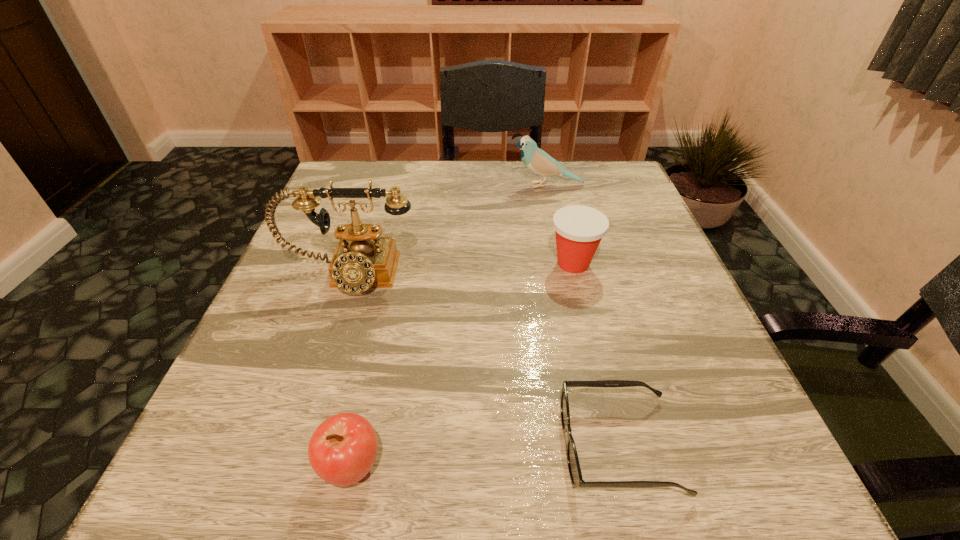
Where is `vacant area at the far right corner of the desktop`? vacant area at the far right corner of the desktop is located at coordinates click(621, 181).

Image resolution: width=960 pixels, height=540 pixels. Identify the location of vacant area that lies between the telephone and the Dixie cup. (461, 269).

The image size is (960, 540). In order to click on vacant area that lies between the sunglasses and the tallest object in this screenshot , I will do `click(484, 360)`.

Find the location of a particular element. The height and width of the screenshot is (540, 960). vacant space that's between the sunglasses and the tallest object is located at coordinates (484, 360).

Identify the location of vacant area between the bird and the tallest object. (447, 231).

The height and width of the screenshot is (540, 960). Identify the location of free space between the shortest object and the apple. (486, 456).

At what (x,y) coordinates should I click in order to perform the action: click on free spot between the second tallest object and the telephone. Please return your answer as a coordinate pair (x, y). The height and width of the screenshot is (540, 960). Looking at the image, I should click on (447, 231).

In order to click on vacant point located between the tallest object and the Dixie cup in this screenshot , I will do `click(461, 269)`.

Where is `vacant area that lies between the shortest object and the apple`? The width and height of the screenshot is (960, 540). vacant area that lies between the shortest object and the apple is located at coordinates [486, 456].

Identify which object is located as the third nearest to the shortest object. Please provide its 2D coordinates. Your answer should be formatted as a tuple, i.e. [(x, y)], where the tuple contains the x and y coordinates of a point satisfying the conditions above.

[(362, 259)]